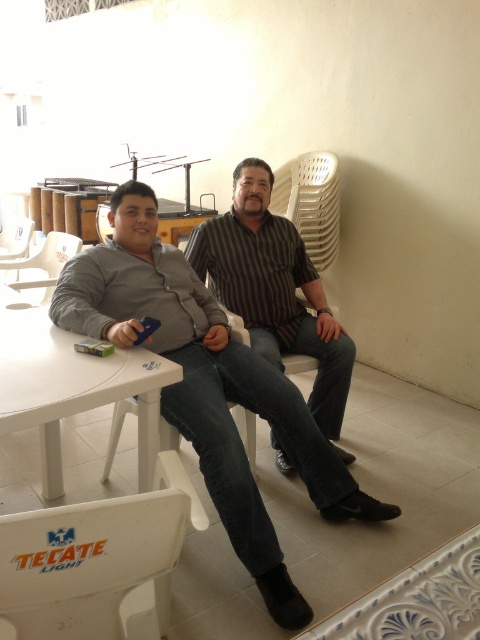
Question: Which point is farther from the camera taking this photo?

Choices:
 (A) (163, 336)
 (B) (32, 228)
 (C) (180, 368)
 (D) (52, 237)

Answer: (B)

Question: Is white plastic chair at lower left smaller than white plastic chair at upper left?

Choices:
 (A) no
 (B) yes

Answer: (B)

Question: Which object is the farthest from the white plastic table at lower left?

Choices:
 (A) gray cotton shirt at center
 (B) white plastic chair at upper left
 (C) white plastic chair at left

Answer: (C)

Question: Estimate the real-world distances between objects in this image. Which object is closer to the white plastic chair at lower left?

Choices:
 (A) white plastic table at lower left
 (B) white plastic chair at left
 (C) white plastic chair at upper left
 (D) brown striped shirt at center

Answer: (A)

Question: Observing the image, what is the correct spatial positioning of white plastic chair at lower left in reference to brown striped shirt at center?

Choices:
 (A) right
 (B) left

Answer: (B)

Question: Does white plastic chair at upper left appear on the left side of white plastic chair at left?

Choices:
 (A) no
 (B) yes

Answer: (A)